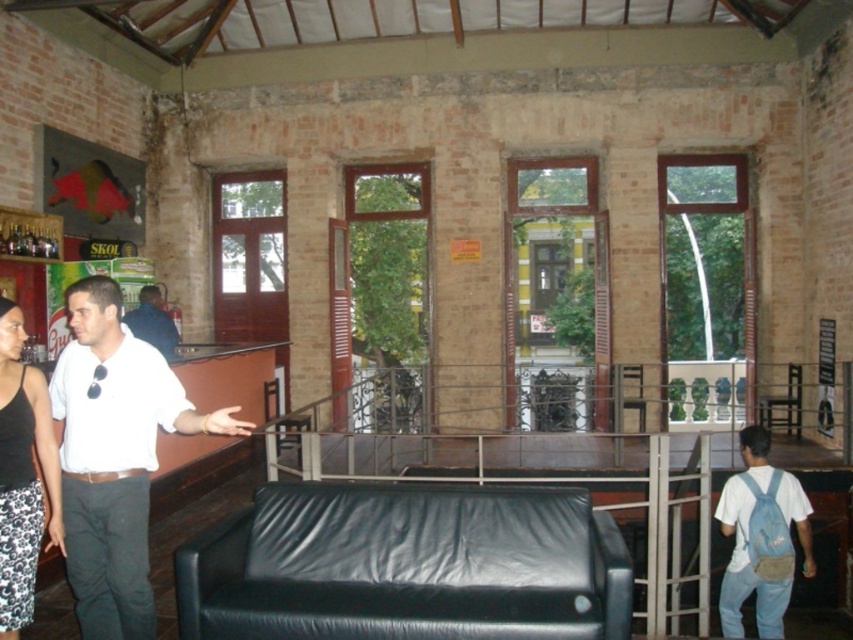
You are a photographer setting up for a group photo in this room. You notice the white shirt at left and the black textured tank top at left are too close. What is the minimum distance you should move them apart to ensure they are at least 12 inches apart?

The white shirt at left and black textured tank top at left are currently 10.37 inches apart. To reach the required 12 inches, they need to move apart by an additional 1.63 inches.

You are standing in the room and want to place a new plant pot between the white shirt at left and the denim backpack at lower right. Based on their positions, which object should the plant pot be closer to?

The white shirt at left is positioned on the left side of denim backpack at lower right, so the plant pot should be placed closer to the white shirt at left to maintain symmetry between them.

You are standing in the room and want to find the white shirt at left. Based on the coordinates provided, in which area of the room should you look?

The white shirt at left is located at coordinates point (114, 456), so you should look in the lower left area of the room.